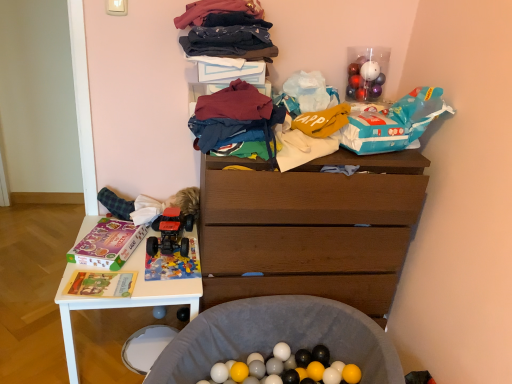
You are a GUI agent. You are given a task and a screenshot of the screen. Output one action in this format:
    pyautogui.click(x=<x>, y=<y>)
    Task: Click on the free point above dark blue cotton socks at upper center, positioned as the first clothing in top-to-bottom order (from a real-world perspective)
    
    Given the screenshot: What is the action you would take?
    pyautogui.click(x=228, y=26)